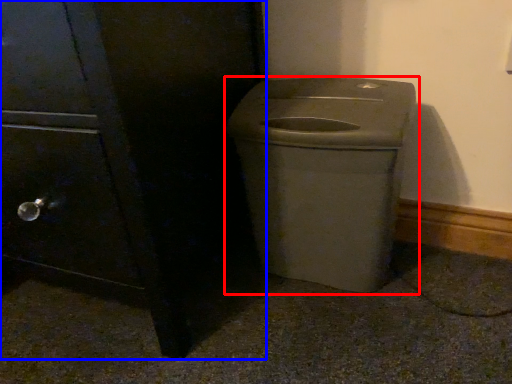
Question: Which object appears closest to the camera in this image, waste container (highlighted by a red box) or side cabinet (highlighted by a blue box)?

Choices:
 (A) waste container
 (B) side cabinet

Answer: (B)